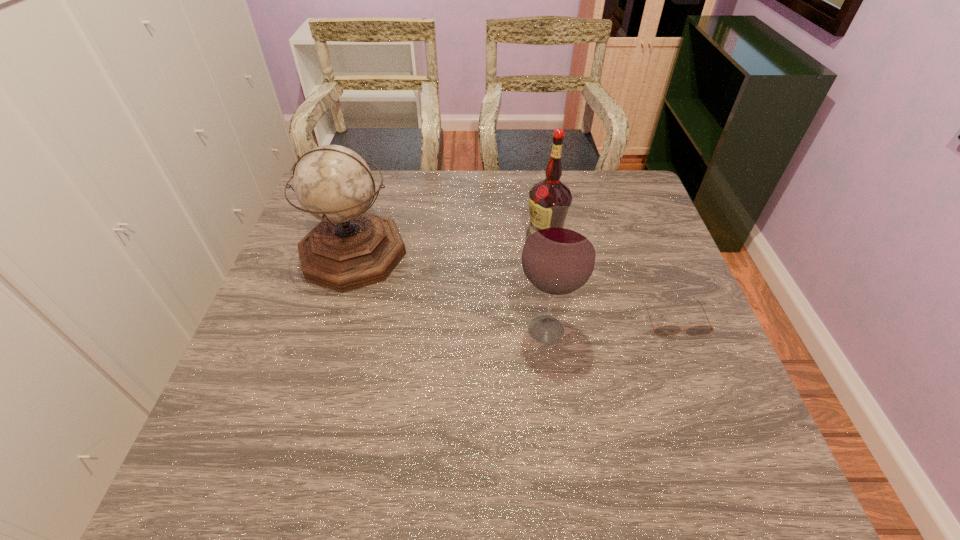
Locate an element on the screen. This screenshot has height=540, width=960. vacant space situated 0.050m on the face of the rightmost object is located at coordinates (687, 354).

Locate an element on the screen. This screenshot has width=960, height=540. object that is at the left edge is located at coordinates (350, 248).

At what (x,y) coordinates should I click in order to perform the action: click on object situated at the right edge. Please return your answer as a coordinate pair (x, y). Looking at the image, I should click on (666, 330).

In the image, there is a desktop. In order to click on free space at the far edge in this screenshot , I will do `click(574, 182)`.

Identify the location of vacant space at the near edge. This screenshot has width=960, height=540. (453, 454).

This screenshot has height=540, width=960. I want to click on vacant space at the left edge of the desktop, so pyautogui.click(x=304, y=233).

Image resolution: width=960 pixels, height=540 pixels. Find the location of `free space at the right edge of the desktop`. free space at the right edge of the desktop is located at coordinates (709, 374).

Locate an element on the screen. vacant point at the near left corner is located at coordinates (268, 471).

The image size is (960, 540). I want to click on free point at the far right corner, so click(607, 199).

The height and width of the screenshot is (540, 960). In the image, there is a desktop. In order to click on vacant space at the near right corner in this screenshot , I will do `click(755, 462)`.